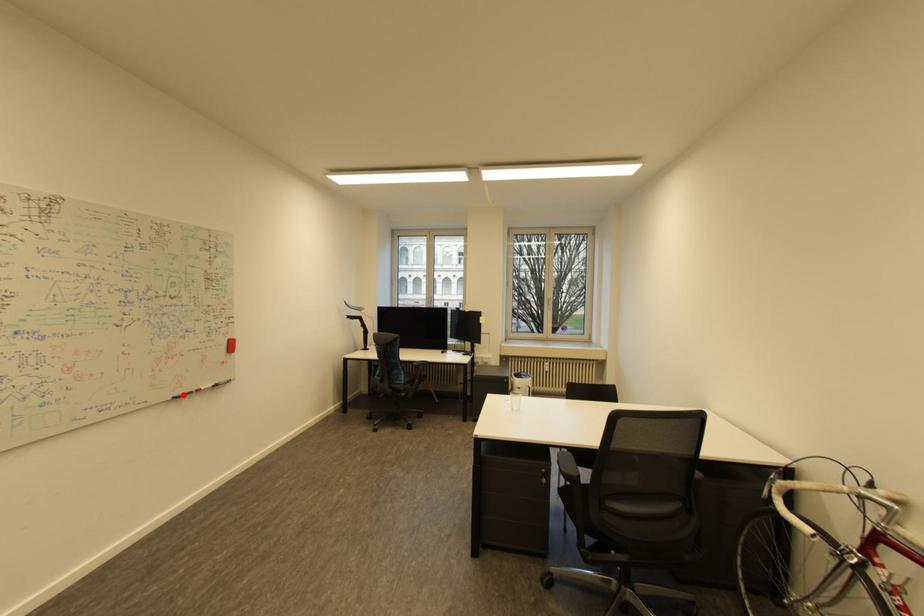
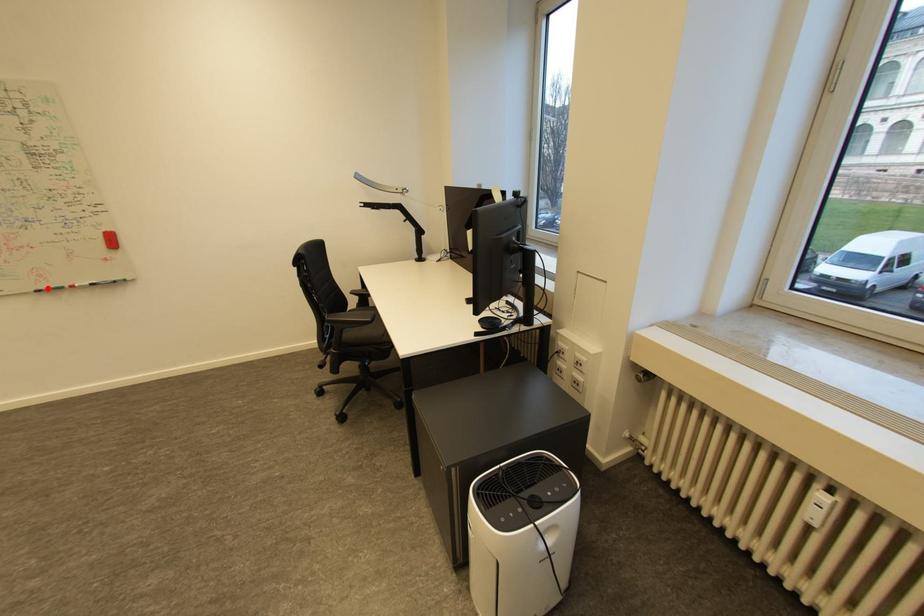
In the scene shown: I am providing you with two images of the same scene from different viewpoints. A red point is marked on the first image and another point is marked on the second image. Is the red point in image1 aligned with the point shown in image2?

Yes